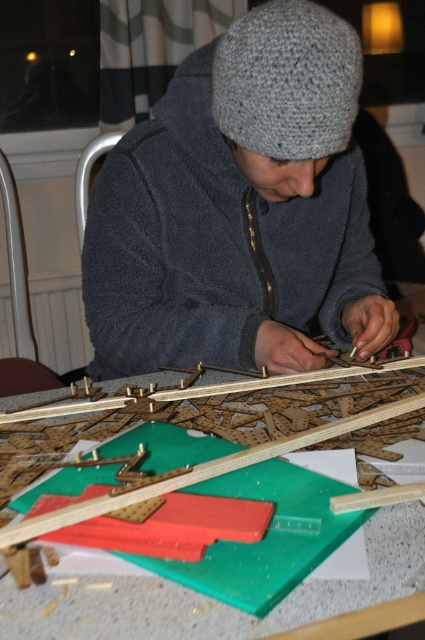
Question: Which object is positioned closest to the gray knitted hat at upper center?

Choices:
 (A) green plastic table at center
 (B) gray knitted hat at center

Answer: (B)

Question: From the image, what is the correct spatial relationship of gray knitted hat at center in relation to green plastic table at center?

Choices:
 (A) right
 (B) left

Answer: (A)

Question: Can you confirm if gray knitted hat at upper center is positioned to the left of green plastic table at center?

Choices:
 (A) yes
 (B) no

Answer: (A)

Question: Which point is closer to the camera taking this photo?

Choices:
 (A) (373, 612)
 (B) (223, 96)

Answer: (A)

Question: Considering the real-world distances, which object is farthest from the gray knitted hat at center?

Choices:
 (A) gray knitted hat at upper center
 (B) green plastic table at center

Answer: (B)

Question: Is gray knitted hat at center closer to the viewer compared to green plastic table at center?

Choices:
 (A) no
 (B) yes

Answer: (A)